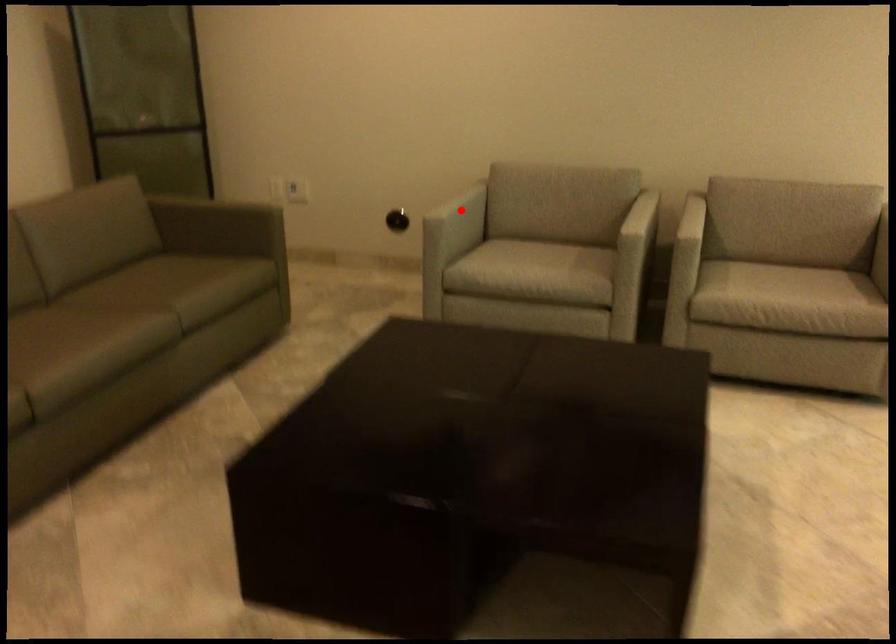
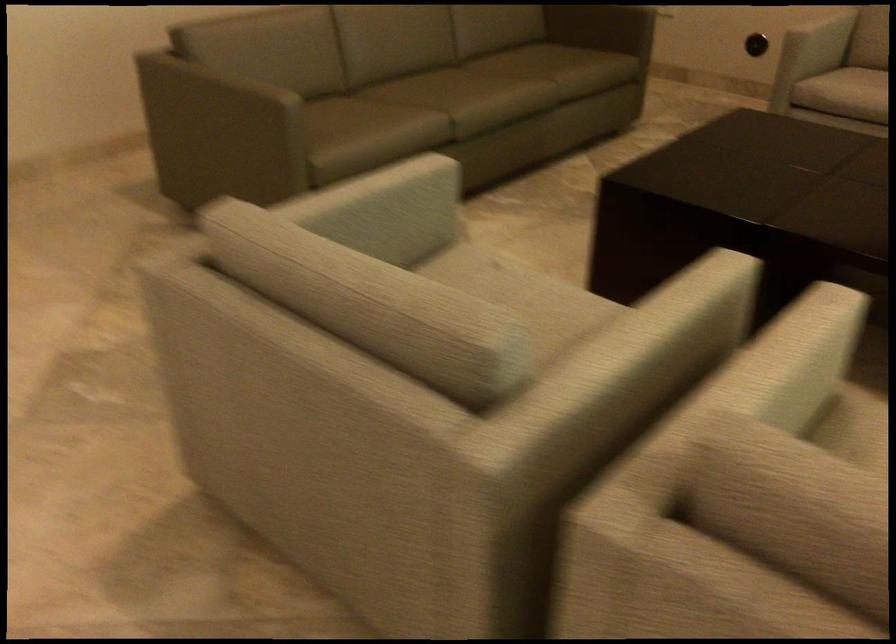
Find the pixel in the second image that matches the highlighted location in the first image.

(821, 35)